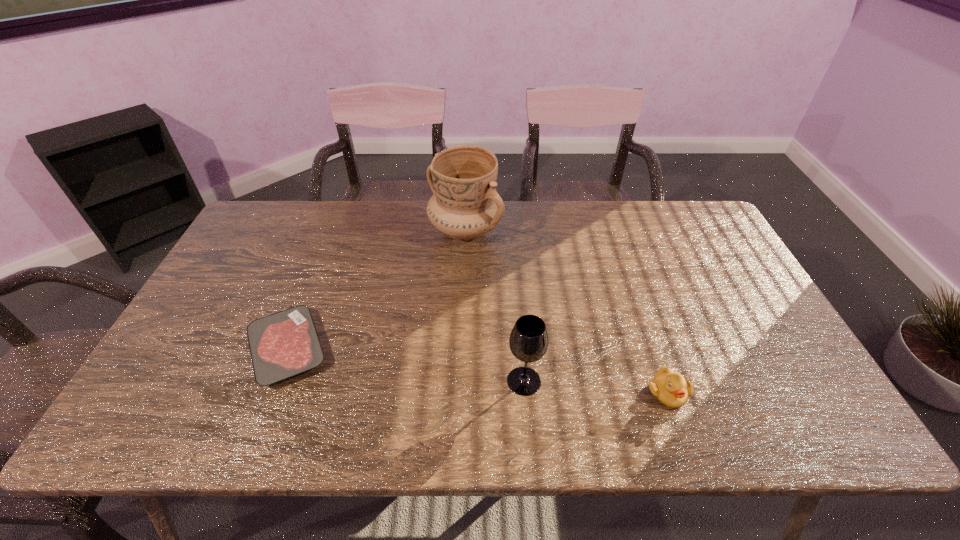
You are a GUI agent. You are given a task and a screenshot of the screen. Output one action in this format:
    pyautogui.click(x=<x>, y=<y>)
    Task: Click on the vacant space that's between the wineglass and the pottery
    This screenshot has height=540, width=960.
    Given the screenshot: What is the action you would take?
    pyautogui.click(x=494, y=305)

Where is `free point between the wineglass and the farthest object`? This screenshot has width=960, height=540. free point between the wineglass and the farthest object is located at coordinates (494, 305).

This screenshot has width=960, height=540. I want to click on vacant area between the duckling and the shortest object, so click(x=477, y=371).

Find the location of `vacant space that is in between the pottery and the wineglass`. vacant space that is in between the pottery and the wineglass is located at coordinates (494, 305).

Find the location of a particular element. vacant area between the duckling and the leftmost object is located at coordinates (477, 371).

This screenshot has height=540, width=960. I want to click on unoccupied area between the rightmost object and the shortest object, so click(x=477, y=371).

At what (x,y) coordinates should I click in order to perform the action: click on vacant space in between the leftmost object and the second shortest object. Please return your answer as a coordinate pair (x, y). Looking at the image, I should click on (477, 371).

At what (x,y) coordinates should I click in order to perform the action: click on empty space between the leftmost object and the rightmost object. Please return your answer as a coordinate pair (x, y). The width and height of the screenshot is (960, 540). Looking at the image, I should click on (477, 371).

Identify which object is the third closest to the leftmost object. Please provide its 2D coordinates. Your answer should be formatted as a tuple, i.e. [(x, y)], where the tuple contains the x and y coordinates of a point satisfying the conditions above.

[(670, 388)]

Locate an element on the screen. The width and height of the screenshot is (960, 540). object that is the closest to the leftmost object is located at coordinates (465, 205).